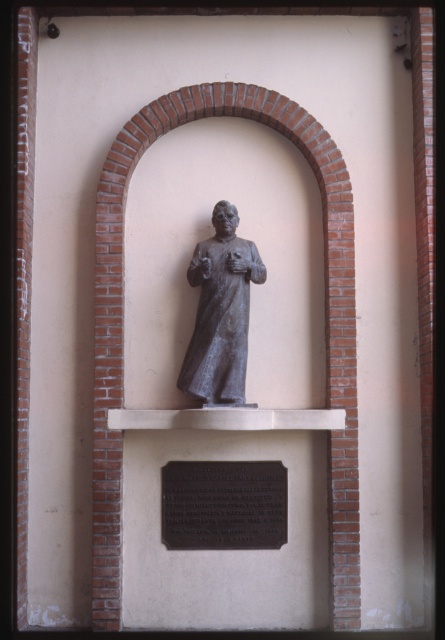
You are an art conservator tasked with inspecting the bronze statue at center and the bronze plaque at center. Your inspection requires you to check the condition of both objects. Since you can only use a ladder once, which object should you check first without needing to climb the ladder?

The bronze plaque at center is located below the bronze statue at center, so you should check the bronze plaque at center first since it is lower and accessible without a ladder. Afterward, you can use the ladder to reach the bronze statue at center.

You are an art conservator assessing the space in front of the bronze statue at center and the bronze plaque at center. You need to place a protective barrier that must be narrower than both objects. What is the maximum width the barrier can be without exceeding the narrower object?

The bronze plaque at center is wider than the bronze statue at center. Therefore, the bronze statue at center is the narrower object. The barrier must be narrower than the bronze statue at center to fit within both spaces.

You are standing in front of the alcove and want to touch the bronze statue at center. Is the bronze plaque at center blocking your path to the statue?

The bronze plaque at center is further to the viewer than bronze statue at center, so it is in front of the statue. Therefore, the bronze plaque at center is blocking your path to the bronze statue at center.